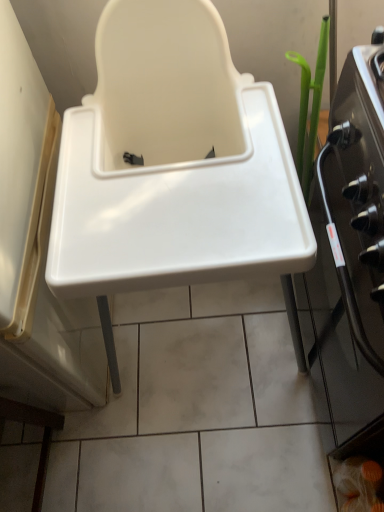
Question: Could black glass oven at right be considered to be inside white plastic sink at center?

Choices:
 (A) yes
 (B) no

Answer: (B)

Question: Is white plastic sink at center turned away from black glass oven at right?

Choices:
 (A) yes
 (B) no

Answer: (B)

Question: Is white plastic sink at center in contact with black glass oven at right?

Choices:
 (A) no
 (B) yes

Answer: (A)

Question: Considering the relative positions of white plastic sink at center and black glass oven at right in the image provided, is white plastic sink at center to the left of black glass oven at right from the viewer's perspective?

Choices:
 (A) no
 (B) yes

Answer: (B)

Question: From a real-world perspective, is white plastic sink at center positioned under black glass oven at right based on gravity?

Choices:
 (A) yes
 (B) no

Answer: (B)

Question: Is white plastic sink at center at the right side of black glass oven at right?

Choices:
 (A) no
 (B) yes

Answer: (A)

Question: Is black glass oven at right positioned with its back to white plastic sink at center?

Choices:
 (A) no
 (B) yes

Answer: (A)

Question: Does black glass oven at right appear on the right side of white plastic sink at center?

Choices:
 (A) no
 (B) yes

Answer: (B)

Question: From a real-world perspective, does black glass oven at right stand above white plastic sink at center?

Choices:
 (A) no
 (B) yes

Answer: (A)

Question: Is black glass oven at right taller than white plastic sink at center?

Choices:
 (A) yes
 (B) no

Answer: (B)

Question: Is black glass oven at right completely or partially outside of white plastic sink at center?

Choices:
 (A) no
 (B) yes

Answer: (B)

Question: Is black glass oven at right wider than white plastic sink at center?

Choices:
 (A) no
 (B) yes

Answer: (A)

Question: Considering the positions of black glass oven at right and white plastic sink at center in the image, is black glass oven at right wider or thinner than white plastic sink at center?

Choices:
 (A) thin
 (B) wide

Answer: (A)